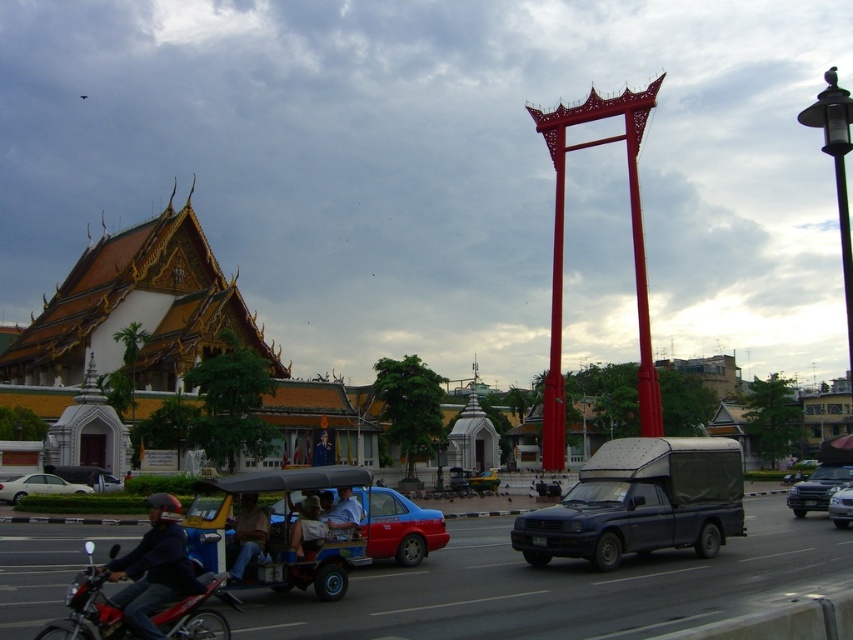
Consider the image. You are a pedestrian standing at the edge of the road in the scene. You see the dark gray matte truck at center and the denim jacket at lower center. Which object is closer to you?

The dark gray matte truck at center is closer to you because it is further to the viewer than the denim jacket at lower center.

You are a pedestrian standing at the intersection and need to cross the street. There is a metallic blue taxi at center and a denim jacket at lower center in your view. Which object is closer to you?

The denim jacket at lower center is closer to you because it is positioned at lower center, which is typically closer to the viewer in such scenes, whereas the metallic blue taxi at center might be further back despite being taller.

You are a delivery person who needs to load a tall package into your vehicle. You have a metallic silver pickup truck at center and a white matte sedan at lower left available. Which vehicle should you choose to ensure the package fits without damaging it?

The metallic silver pickup truck at center is taller than the white matte sedan at lower left, so you should choose the metallic silver pickup truck at center to ensure the tall package fits without damage.